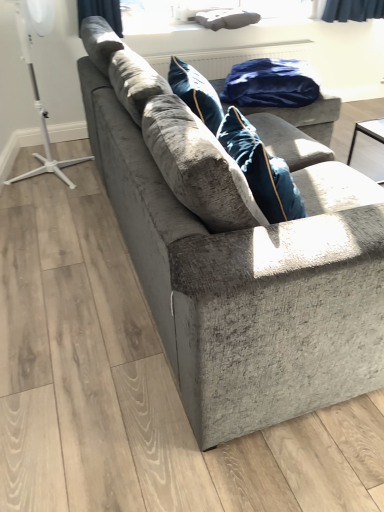
You are a GUI agent. You are given a task and a screenshot of the screen. Output one action in this format:
    pyautogui.click(x=<x>, y=<y>)
    Task: Click on the free area in between white plastic tripod at left and velvet gray couch at center
    This screenshot has width=384, height=512.
    Given the screenshot: What is the action you would take?
    pyautogui.click(x=81, y=238)